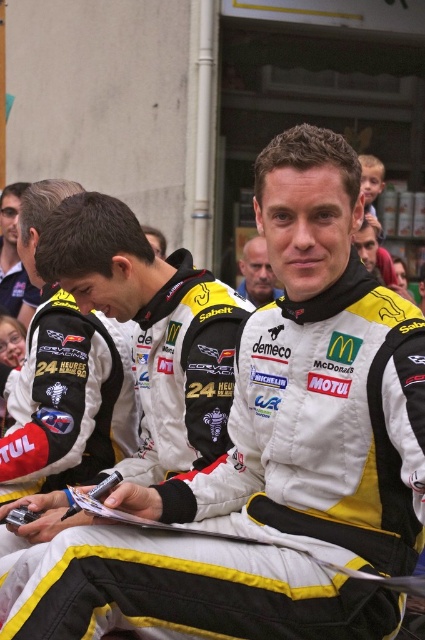
You are a photographer standing at the edge of the signing area. You want to take a photo that includes both the matte black helmet at upper left and the white leather jacket at center. Given that your camera has a maximum focus range of 3 meters, will you be able to capture both objects in a single focused shot?

The distance between the matte black helmet at upper left and the white leather jacket at center is 3.29 meters. Since your camera can only focus within 3 meters, you won be able to capture both objects in a single focused shot.

You are a photographer at the event and want to capture a clear shot of the white leather jacket at center without the matte black helmet at upper left blocking it. How should you adjust your camera angle?

The matte black helmet at upper left is positioned over the white leather jacket at center, so to avoid blocking, adjust the camera angle downward to focus on the jacket below the helmet.